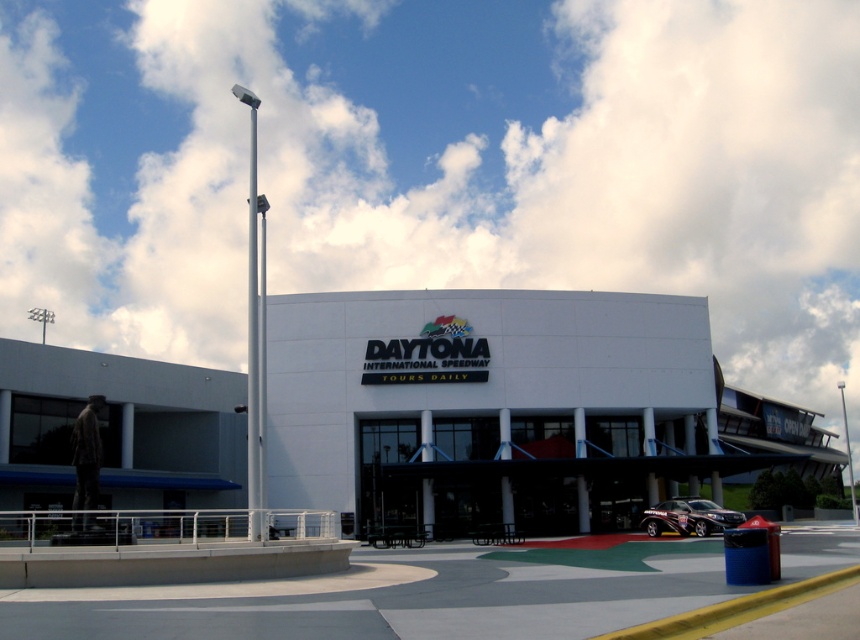
You are a visitor at the Daytona International Speedway and want to take a photo of the white smooth building at center without the metallic flag pole at right appearing in the background. Is this possible based on the scene description?

Yes, because the white smooth building at center is in front of the metallic flag pole at right, so if you position yourself so the building blocks the flag pole from view, the flag pole won

You are planning to take a photo of the Daytona International Speedway. You want to include both the white smooth building at center and the metallic flag pole at right in your shot. Based on their sizes, which one should you focus on to ensure it takes up more space in the photo?

The metallic flag pole at right is larger in size compared to the white smooth building at center, so focusing on it will ensure it takes up more space in the photo.